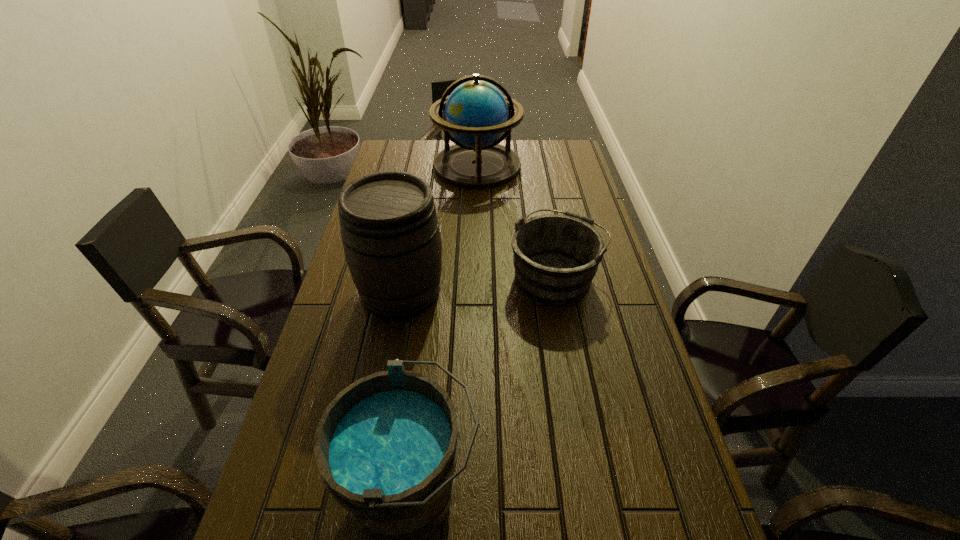
Where is `vacant space at the right edge`? The height and width of the screenshot is (540, 960). vacant space at the right edge is located at coordinates (617, 384).

You are a GUI agent. You are given a task and a screenshot of the screen. Output one action in this format:
    pyautogui.click(x=<x>, y=<y>)
    Task: Click on the vacant space at the far right corner of the desktop
    The height and width of the screenshot is (540, 960).
    Given the screenshot: What is the action you would take?
    pyautogui.click(x=548, y=161)

Image resolution: width=960 pixels, height=540 pixels. Identify the location of free space between the shortest object and the farthest object. (516, 221).

I want to click on vacant space that is in between the rightmost wine bucket and the farthest object, so click(x=516, y=221).

You are a GUI agent. You are given a task and a screenshot of the screen. Output one action in this format:
    pyautogui.click(x=<x>, y=<y>)
    Task: Click on the object that stands as the third closest to the farthest object
    This screenshot has width=960, height=540.
    Given the screenshot: What is the action you would take?
    pyautogui.click(x=386, y=447)

What are the coordinates of `object identified as the closest to the farthest object` in the screenshot? It's located at (556, 257).

This screenshot has width=960, height=540. I want to click on wine bucket that is the closest to the nearest object, so click(x=390, y=232).

This screenshot has height=540, width=960. Identify the location of wine bucket that is the third closest to the farthest object. (386, 447).